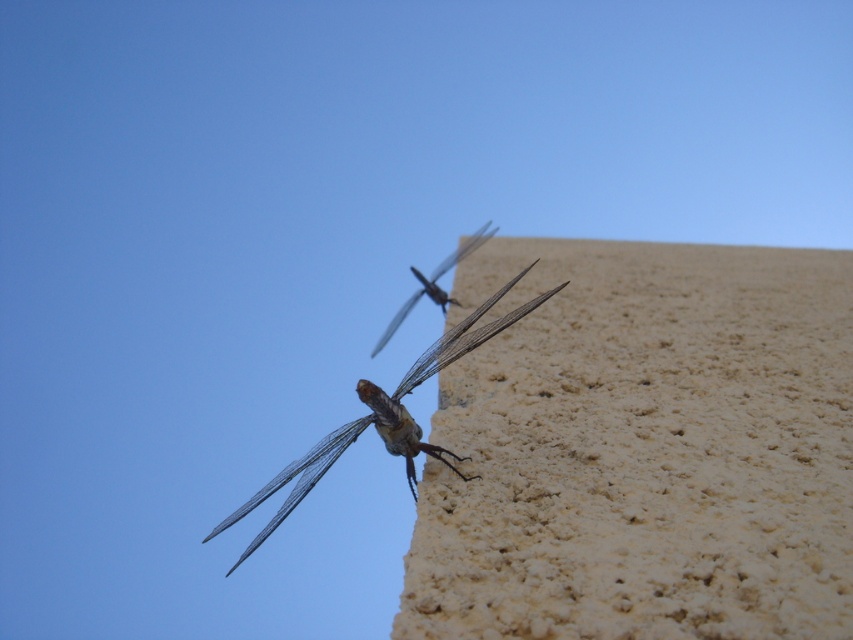
Question: Does translucent glass dragonfly at upper center come in front of translucent winged insect at upper center?

Choices:
 (A) yes
 (B) no

Answer: (A)

Question: Which object appears farthest from the camera in this image?

Choices:
 (A) translucent winged insect at upper center
 (B) translucent glass dragonfly at upper center

Answer: (A)

Question: Which point appears closest to the camera in this image?

Choices:
 (A) (453, 298)
 (B) (401, 384)

Answer: (B)

Question: In this image, where is translucent glass dragonfly at upper center located relative to translucent winged insect at upper center?

Choices:
 (A) above
 (B) below

Answer: (B)

Question: Does translucent glass dragonfly at upper center lie in front of translucent winged insect at upper center?

Choices:
 (A) yes
 (B) no

Answer: (A)